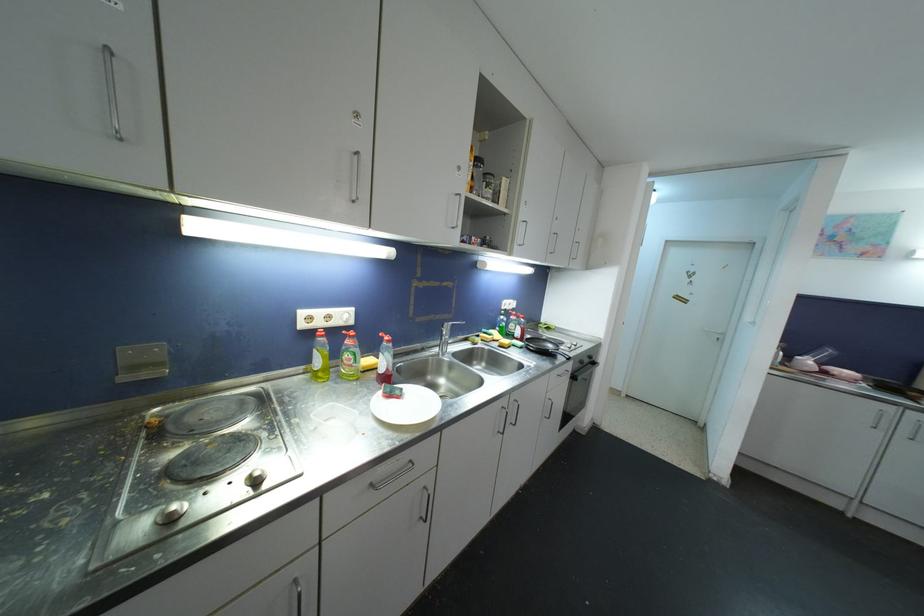
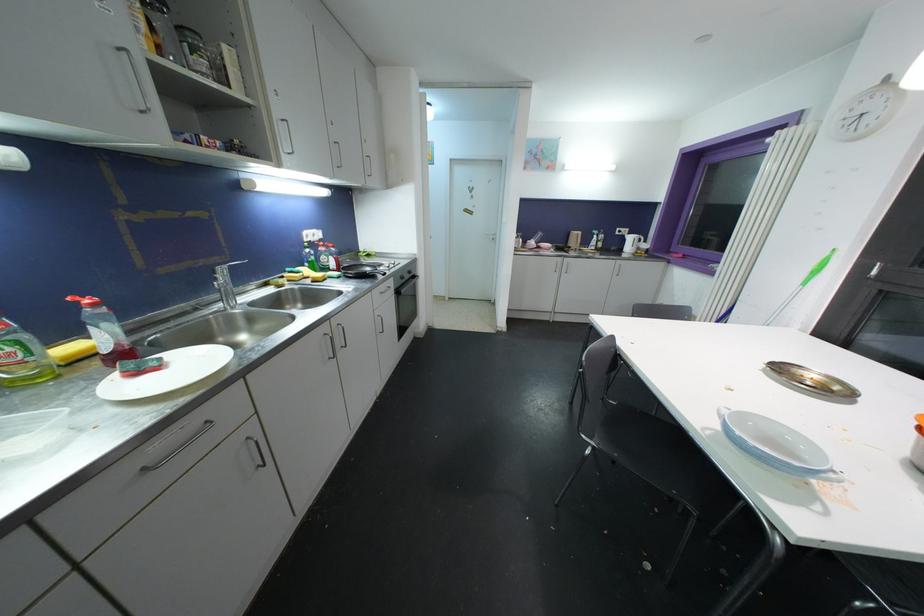
The point at [577,379] is marked in the first image. Where is the corresponding point in the second image?

(400, 294)